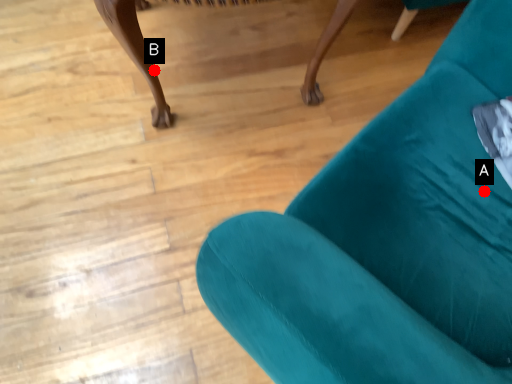
Question: Two points are circled on the image, labeled by A and B beside each circle. Which point is farther to the camera?

Choices:
 (A) A is further
 (B) B is further

Answer: (B)